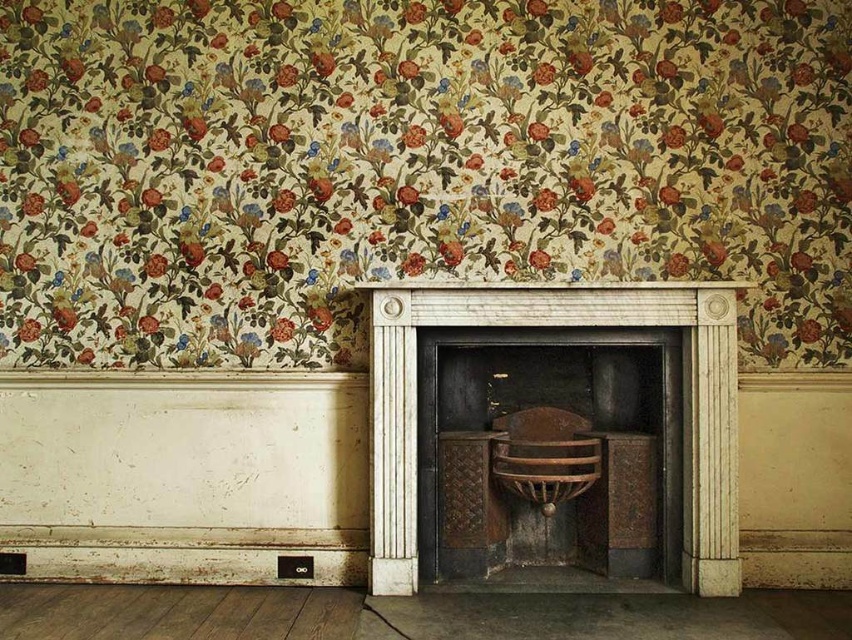
Question: Is white marble fireplace at center to the left of wooden armchair at center from the viewer's perspective?

Choices:
 (A) yes
 (B) no

Answer: (A)

Question: Which point is farther to the camera?

Choices:
 (A) (704, 301)
 (B) (593, 461)

Answer: (B)

Question: Is the position of white marble fireplace at center less distant than that of wooden armchair at center?

Choices:
 (A) no
 (B) yes

Answer: (B)

Question: Which object appears closest to the camera in this image?

Choices:
 (A) wooden armchair at center
 (B) white marble fireplace at center

Answer: (B)

Question: Observing the image, what is the correct spatial positioning of white marble fireplace at center in reference to wooden armchair at center?

Choices:
 (A) left
 (B) right

Answer: (A)